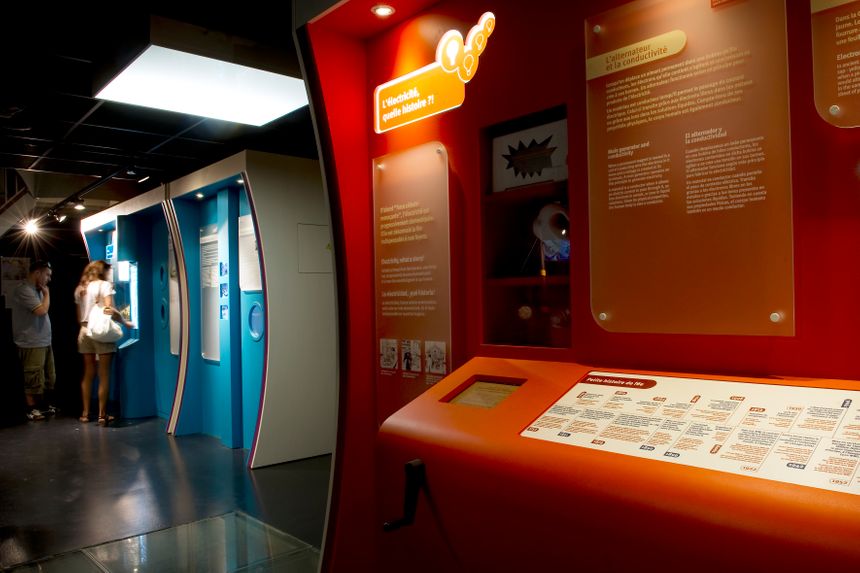
Find the location of `screen`. screen is located at coordinates tap(483, 402).